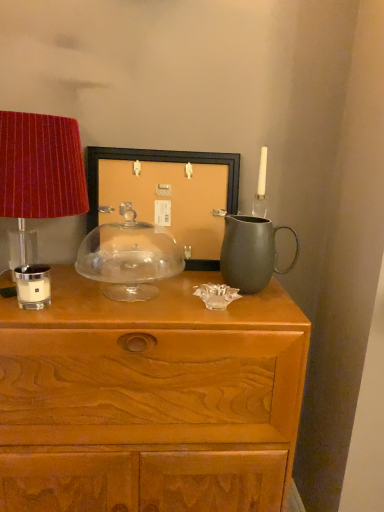
Locate an element on the screen. Image resolution: width=384 pixels, height=512 pixels. free spot in front of white matte candle holder at left, which is the 1th candle holder from left to right is located at coordinates (34, 313).